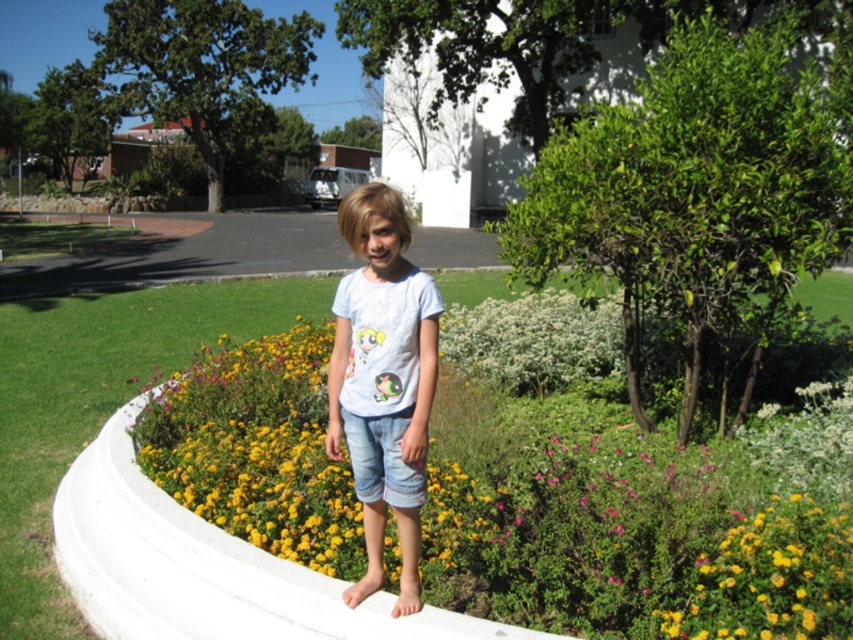
Between yellow matte flowers at center and white cotton t-shirt at center, which one appears on the left side from the viewer's perspective?

yellow matte flowers at center is more to the left.

Can you confirm if yellow matte flowers at center is positioned above white cotton t-shirt at center?

No.

Which is in front, point (236, 492) or point (434, 372)?

Point (434, 372) is more forward.

Locate an element on the screen. This screenshot has width=853, height=640. yellow matte flowers at center is located at coordinates (257, 449).

Does white cotton t-shirt at center have a greater width compared to denim shorts at center?

Correct, the width of white cotton t-shirt at center exceeds that of denim shorts at center.

Who is positioned more to the left, white cotton t-shirt at center or denim shorts at center?

From the viewer's perspective, white cotton t-shirt at center appears more on the left side.

What do you see at coordinates (383, 381) in the screenshot? I see `white cotton t-shirt at center` at bounding box center [383, 381].

This screenshot has height=640, width=853. What are the coordinates of `white cotton t-shirt at center` in the screenshot? It's located at (383, 381).

Is yellow matte flowers at center further to the viewer compared to denim shorts at center?

Yes, yellow matte flowers at center is behind denim shorts at center.

Does yellow matte flowers at center have a greater height compared to denim shorts at center?

Yes.

Does point (453, 563) lie in front of point (369, 438)?

No, (453, 563) is behind (369, 438).

Find the location of `yellow matte flowers at center`. yellow matte flowers at center is located at coordinates pos(257,449).